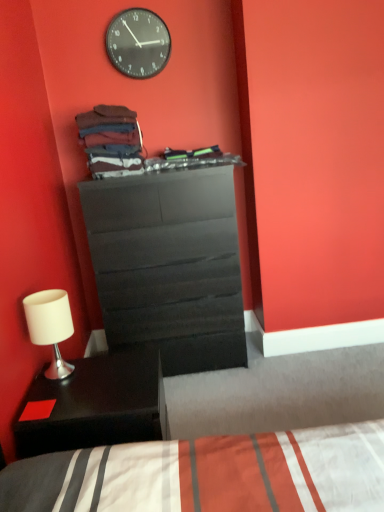
Question: Is matte black dresser at center at the left side of white matte table lamp at lower left?

Choices:
 (A) no
 (B) yes

Answer: (A)

Question: Would you consider matte black dresser at center to be distant from white matte table lamp at lower left?

Choices:
 (A) no
 (B) yes

Answer: (A)

Question: Can you confirm if matte black dresser at center is smaller than white matte table lamp at lower left?

Choices:
 (A) yes
 (B) no

Answer: (B)

Question: Is matte black dresser at center directly adjacent to white matte table lamp at lower left?

Choices:
 (A) yes
 (B) no

Answer: (B)

Question: Is matte black dresser at center wider than white matte table lamp at lower left?

Choices:
 (A) no
 (B) yes

Answer: (B)

Question: Is white matte table lamp at lower left surrounded by matte black dresser at center?

Choices:
 (A) yes
 (B) no

Answer: (B)

Question: From a real-world perspective, is white matte table lamp at lower left under black glass clock at upper center?

Choices:
 (A) yes
 (B) no

Answer: (A)

Question: Can you confirm if white matte table lamp at lower left is positioned to the left of black glass clock at upper center?

Choices:
 (A) yes
 (B) no

Answer: (A)

Question: Considering the relative sizes of white matte table lamp at lower left and black glass clock at upper center in the image provided, is white matte table lamp at lower left thinner than black glass clock at upper center?

Choices:
 (A) yes
 (B) no

Answer: (B)

Question: Are white matte table lamp at lower left and black glass clock at upper center beside each other?

Choices:
 (A) yes
 (B) no

Answer: (B)

Question: Is white matte table lamp at lower left behind black glass clock at upper center?

Choices:
 (A) no
 (B) yes

Answer: (A)

Question: Is the position of white matte table lamp at lower left less distant than that of black glass clock at upper center?

Choices:
 (A) no
 (B) yes

Answer: (B)

Question: Are matte black dresser at center and black glass clock at upper center beside each other?

Choices:
 (A) no
 (B) yes

Answer: (A)